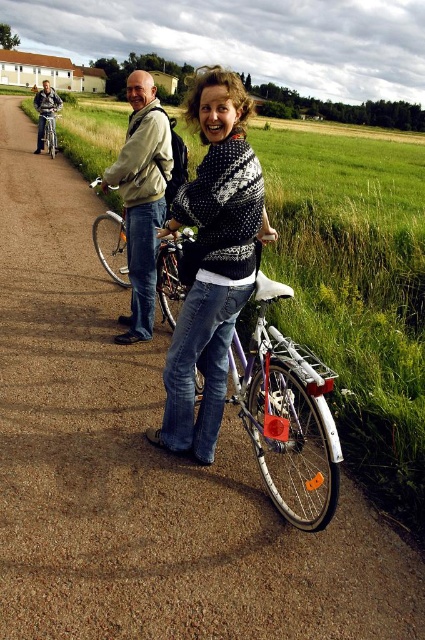
Question: Which point is farther to the camera?

Choices:
 (A) silver metallic bicycle at left
 (B) knitted sweater at center

Answer: (A)

Question: Which object appears farthest from the camera in this image?

Choices:
 (A) metallic silver bicycle at center
 (B) shiny silver bicycle at center

Answer: (B)

Question: Is brushed metal bicycle at left above silver metallic bicycle at left?

Choices:
 (A) yes
 (B) no

Answer: (A)

Question: Which object is the farthest from the brushed metal bicycle at left?

Choices:
 (A) shiny silver bicycle at center
 (B) light beige jacket at center

Answer: (A)

Question: Can you confirm if light beige jacket at center is thinner than brushed metal bicycle at left?

Choices:
 (A) no
 (B) yes

Answer: (B)

Question: In this image, where is light beige jacket at center located relative to shiny silver bicycle at center?

Choices:
 (A) above
 (B) below

Answer: (A)